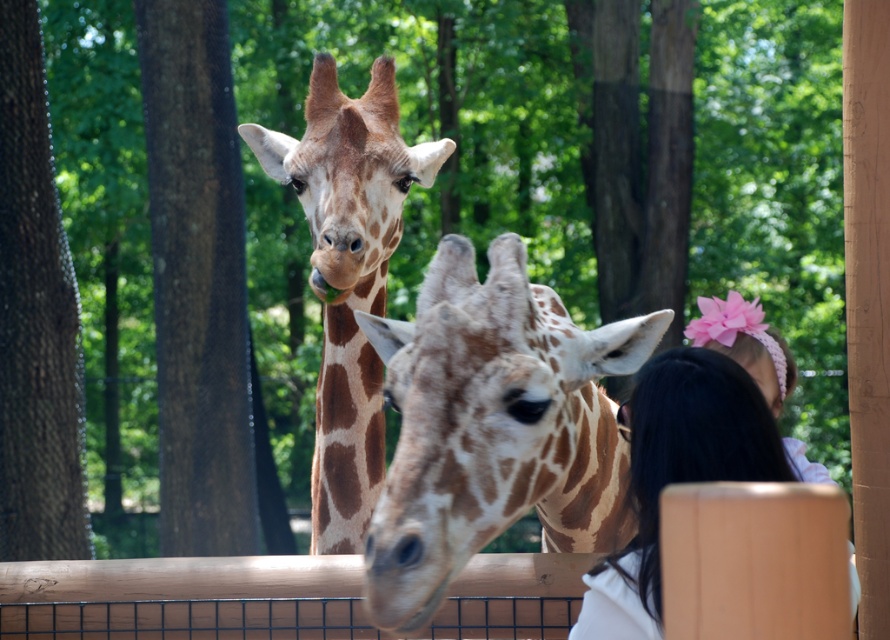
You are a zookeeper observing the brown spotted giraffe at center and the smooth white shirt at lower right. Which object is closer to the front of the image?

The smooth white shirt at lower right is closer to the front of the image because the brown spotted giraffe at center is positioned over it, indicating it is behind.